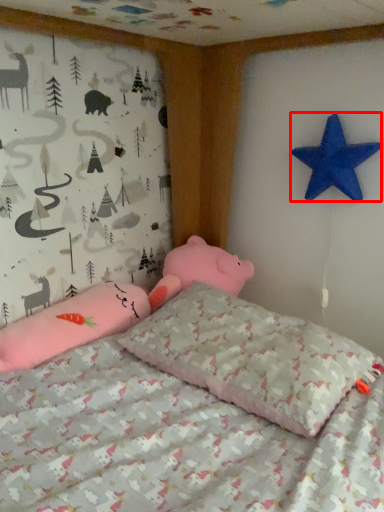
Question: From the image's perspective, considering the relative positions of starfish (annotated by the red box) and pillow in the image provided, where is starfish (annotated by the red box) located with respect to the staircase?

Choices:
 (A) below
 (B) above

Answer: (B)